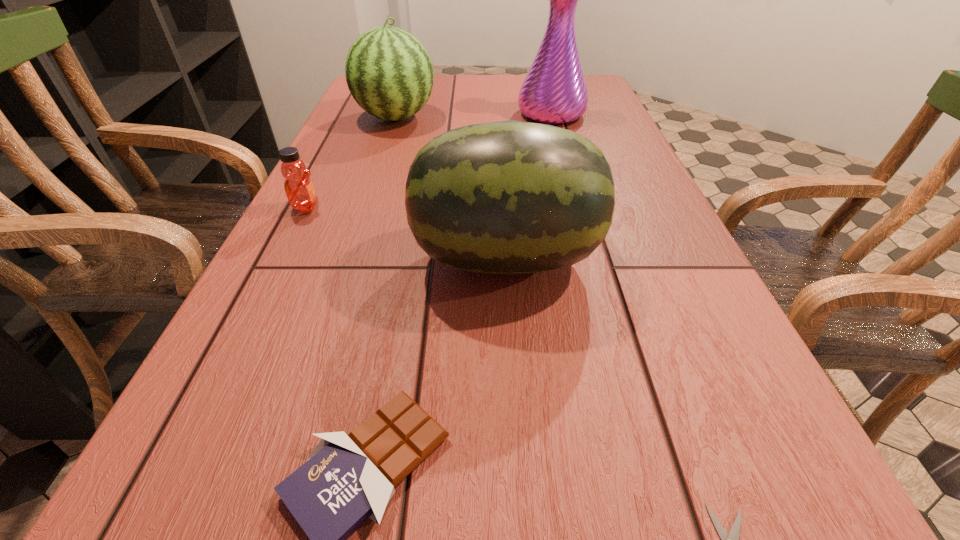
I want to click on the tallest object, so click(554, 91).

The height and width of the screenshot is (540, 960). I want to click on the farther watermelon, so click(389, 73).

The height and width of the screenshot is (540, 960). Identify the location of the nearer watermelon. (510, 197).

You are a GUI agent. You are given a task and a screenshot of the screen. Output one action in this format:
    pyautogui.click(x=<x>, y=<y>)
    Task: Click on the right watermelon
    
    Given the screenshot: What is the action you would take?
    point(510,197)

Where is `honey`? The width and height of the screenshot is (960, 540). honey is located at coordinates (299, 188).

This screenshot has height=540, width=960. Identify the location of the third shortest object. (299, 188).

Where is `vacant area situated on the back of the tallest object`? The height and width of the screenshot is (540, 960). vacant area situated on the back of the tallest object is located at coordinates (540, 76).

Where is `vacant region located on the back of the farther watermelon`? The image size is (960, 540). vacant region located on the back of the farther watermelon is located at coordinates (405, 90).

At what (x,y) coordinates should I click in order to perform the action: click on vacant area situated on the back of the right watermelon. Please return your answer as a coordinate pair (x, y). Looking at the image, I should click on (502, 198).

At what (x,y) coordinates should I click in order to perform the action: click on vacant space located 0.060m on the front label of the honey. Please return your answer as a coordinate pair (x, y). Looking at the image, I should click on (349, 207).